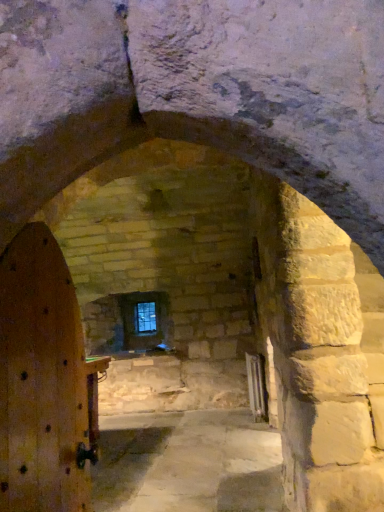
Question: Does wooden door at left lie in front of clear glass window at center?

Choices:
 (A) no
 (B) yes

Answer: (B)

Question: From the image's perspective, is wooden door at left over clear glass window at center?

Choices:
 (A) no
 (B) yes

Answer: (B)

Question: Considering the relative sizes of wooden door at left and clear glass window at center in the image provided, is wooden door at left taller than clear glass window at center?

Choices:
 (A) no
 (B) yes

Answer: (B)

Question: Is the surface of wooden door at left in direct contact with clear glass window at center?

Choices:
 (A) no
 (B) yes

Answer: (A)

Question: Is wooden door at left aimed at clear glass window at center?

Choices:
 (A) no
 (B) yes

Answer: (A)

Question: Is wooden door at left surrounding clear glass window at center?

Choices:
 (A) yes
 (B) no

Answer: (B)

Question: Considering the relative positions of clear glass window at center and wooden door at left in the image provided, is clear glass window at center in front of wooden door at left?

Choices:
 (A) no
 (B) yes

Answer: (A)

Question: From the image's perspective, is clear glass window at center on wooden door at left?

Choices:
 (A) no
 (B) yes

Answer: (A)

Question: From the image's perspective, is clear glass window at center below wooden door at left?

Choices:
 (A) yes
 (B) no

Answer: (A)

Question: Could you tell me if clear glass window at center is facing wooden door at left?

Choices:
 (A) yes
 (B) no

Answer: (A)

Question: Can you confirm if clear glass window at center is positioned to the left of wooden door at left?

Choices:
 (A) no
 (B) yes

Answer: (B)

Question: Can you confirm if clear glass window at center is wider than wooden door at left?

Choices:
 (A) yes
 (B) no

Answer: (B)

Question: In terms of size, does wooden door at left appear bigger or smaller than clear glass window at center?

Choices:
 (A) small
 (B) big

Answer: (B)